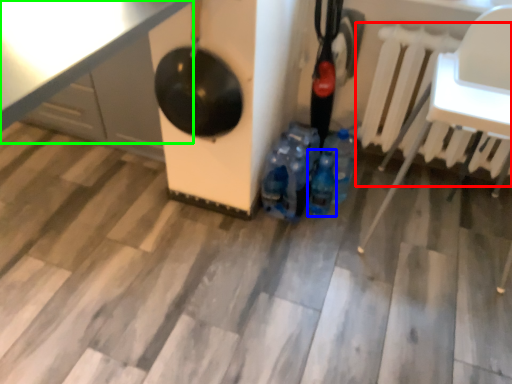
Question: Which object is the farthest from radiator (highlighted by a red box)? Choose among these: bottle (highlighted by a blue box) or table (highlighted by a green box).

Choices:
 (A) bottle
 (B) table

Answer: (B)